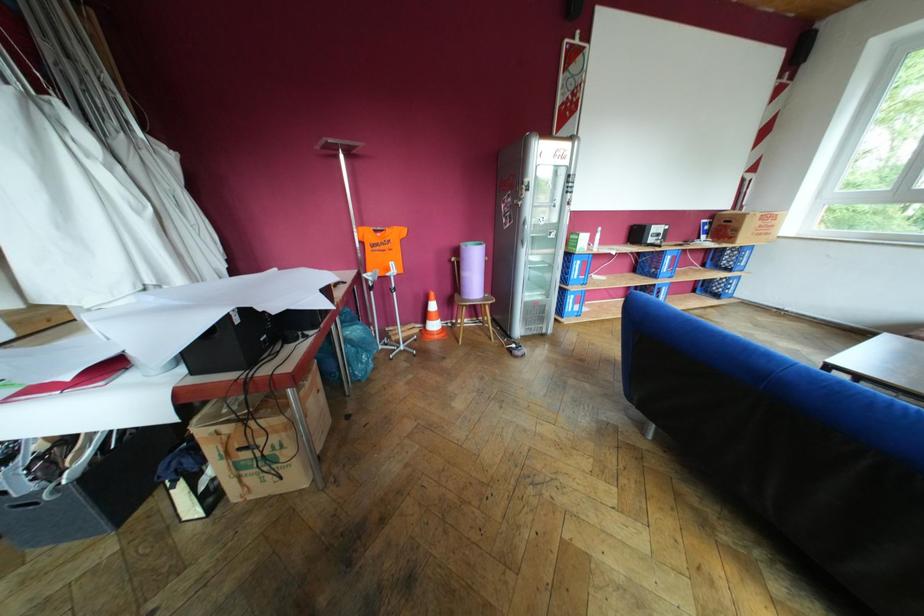
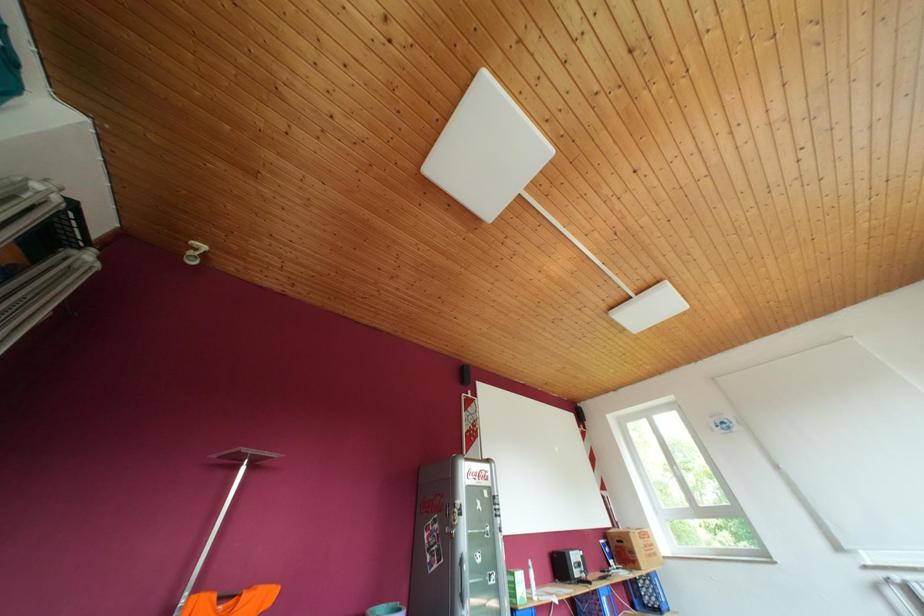
The first image is from the beginning of the video and the second image is from the end. How did the camera likely rotate when shooting the video?

The rotation direction of the camera is right-up.